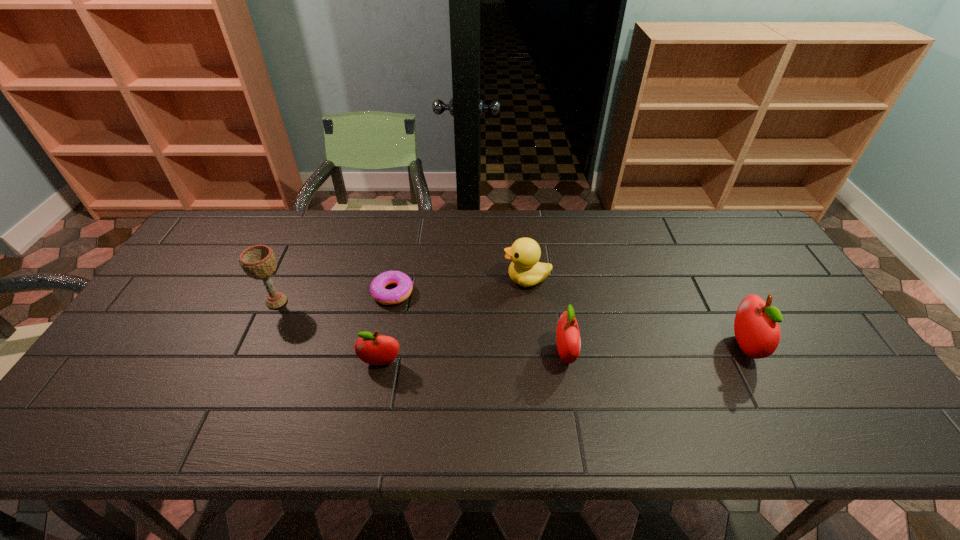
At what (x,y) coordinates should I click in order to perform the action: click on the second shortest object. Please return your answer as a coordinate pair (x, y). Looking at the image, I should click on coord(375,350).

Find the location of `the leftmost apple`. the leftmost apple is located at coordinates (375, 350).

This screenshot has width=960, height=540. I want to click on the second apple from left to right, so click(x=568, y=339).

I want to click on the rightmost apple, so [x=756, y=328].

Find the location of `the shortest object`. the shortest object is located at coordinates (399, 294).

At what (x,y) coordinates should I click in order to perform the action: click on chalice. Please return your answer as a coordinate pair (x, y). Looking at the image, I should click on (258, 262).

Where is `duck`? This screenshot has height=540, width=960. duck is located at coordinates (525, 270).

Identify the location of free spot located on the back of the shortest apple. Image resolution: width=960 pixels, height=540 pixels. (388, 325).

Identify the location of free region located 0.340m on the right of the second tallest apple. This screenshot has width=960, height=540. (709, 354).

Where is `vacant space situated on the back of the rightmost object`? vacant space situated on the back of the rightmost object is located at coordinates (685, 238).